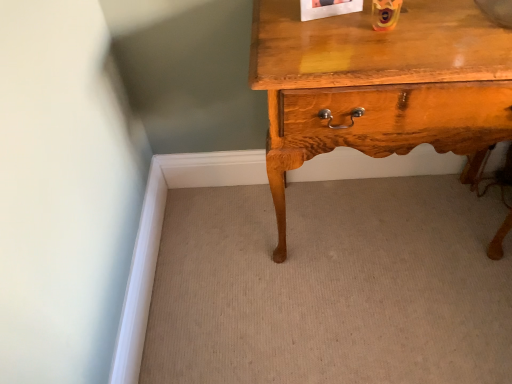
Where is `free point below glossy wood nightstand at right (from a real-world perspective)`? Image resolution: width=512 pixels, height=384 pixels. free point below glossy wood nightstand at right (from a real-world perspective) is located at coordinates (387, 219).